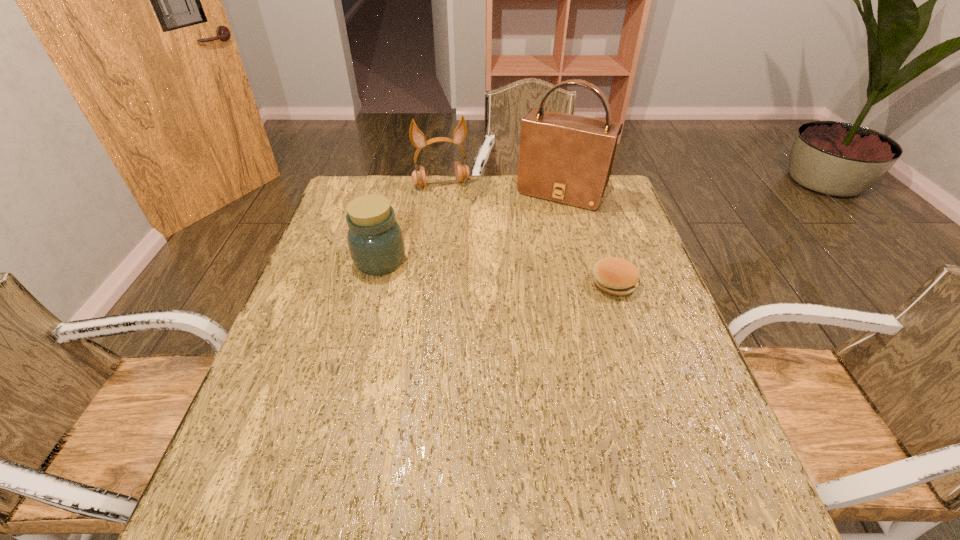
Locate an element on the screen. This screenshot has height=540, width=960. vacant region located on the front flap of the tallest object is located at coordinates (538, 226).

Locate an element on the screen. This screenshot has width=960, height=540. vacant space located 0.170m on the front flap of the tallest object is located at coordinates (529, 241).

The width and height of the screenshot is (960, 540). I want to click on earphone that is at the far edge, so click(x=417, y=138).

Identify the location of shoulder bag that is positioned at the far edge. (564, 158).

I want to click on object positioned at the left edge, so click(375, 240).

Locate an element on the screen. This screenshot has height=540, width=960. patty positioned at the right edge is located at coordinates (615, 276).

Locate an element on the screen. shoulder bag that is at the right edge is located at coordinates (564, 158).

Find the location of `object that is at the far right corner`. object that is at the far right corner is located at coordinates point(564,158).

The image size is (960, 540). Find the location of `free space at the far edge of the desktop`. free space at the far edge of the desktop is located at coordinates (481, 187).

In the image, there is a desktop. Where is `free region at the left edge`? free region at the left edge is located at coordinates (246, 413).